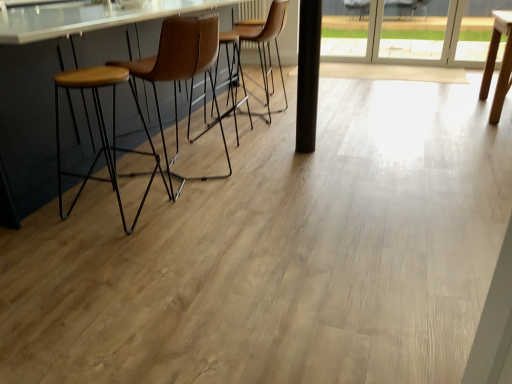
Identify the location of vacant space to the left of black matte pole at center. (280, 144).